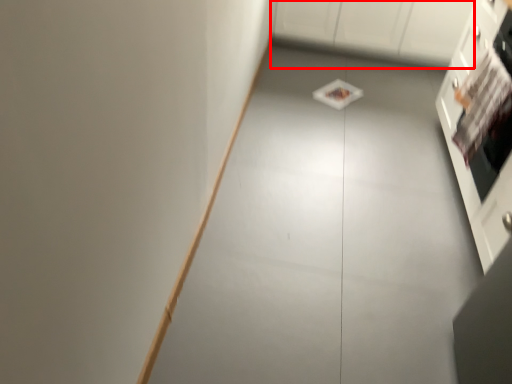
Question: Observing the image, what is the correct spatial positioning of cabinetry (annotated by the red box) in reference to cabinetry?

Choices:
 (A) left
 (B) right

Answer: (A)